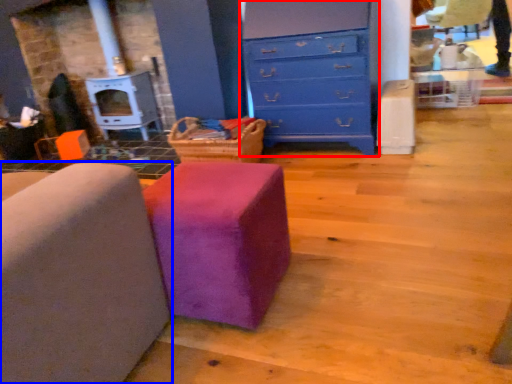
Question: Which of the following is the farthest to the observer, chest of drawers (highlighted by a red box) or furniture (highlighted by a blue box)?

Choices:
 (A) chest of drawers
 (B) furniture

Answer: (A)